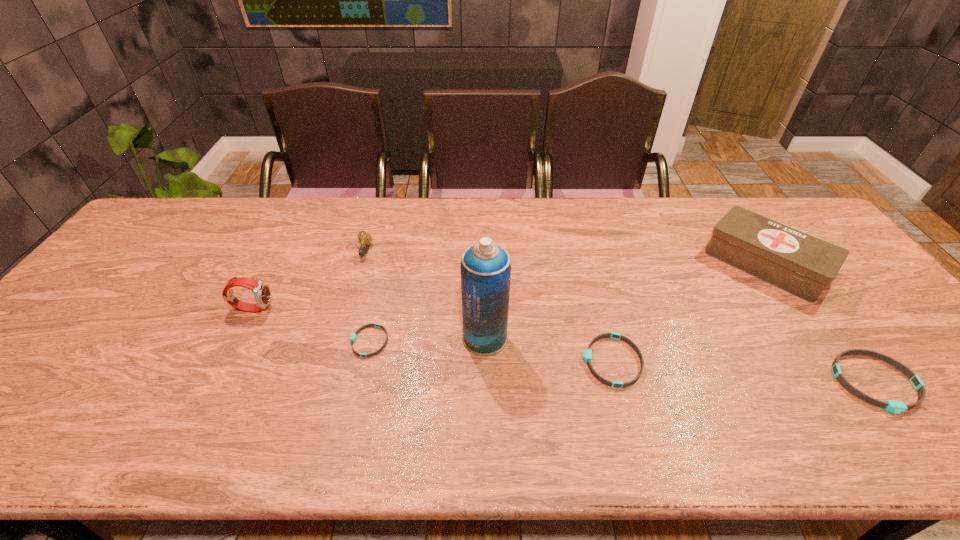
The image size is (960, 540). In order to click on free spot between the tallest object and the first-aid kit in this screenshot , I will do `click(625, 301)`.

Identify the location of object that is the sixth nearest to the fourth object from right to left. The image size is (960, 540). (897, 407).

Identify which object is the sixth nearest to the sixth object from right to left. Please provide its 2D coordinates. Your answer should be formatted as a tuple, i.e. [(x, y)], where the tuple contains the x and y coordinates of a point satisfying the conditions above.

[(897, 407)]

You are a GUI agent. You are given a task and a screenshot of the screen. Output one action in this format:
    pyautogui.click(x=<x>, y=<y>)
    Task: Click on the third closest wristband to the fourth shortest object
    
    Given the screenshot: What is the action you would take?
    pyautogui.click(x=897, y=407)

You are a GUI agent. You are given a task and a screenshot of the screen. Output one action in this format:
    pyautogui.click(x=<x>, y=<y>)
    Task: Click on the wristband that stands as the closest to the fifth object from left to right
    
    Given the screenshot: What is the action you would take?
    pyautogui.click(x=897, y=407)

The image size is (960, 540). In order to click on free region that satisfies the following two spatial constraints: 1. on the front-facing side of the fourth object from right to left; 2. on the right side of the sixth object from right to left in this screenshot , I will do tap(340, 338).

You are a GUI agent. You are given a task and a screenshot of the screen. Output one action in this format:
    pyautogui.click(x=<x>, y=<y>)
    Task: Click on the vacant area that satisfies the following two spatial constraints: 1. on the front-facing side of the escargot; 2. on the face of the leftmost object
    This screenshot has height=540, width=960.
    Given the screenshot: What is the action you would take?
    pyautogui.click(x=348, y=308)

I want to click on blank space that satisfies the following two spatial constraints: 1. on the face of the tallest object; 2. on the right side of the leftmost object, so click(238, 338).

What are the coordinates of `vacant region that satisfies the following two spatial constraints: 1. on the face of the tallest object; 2. on the left side of the leftmost object` in the screenshot? It's located at (238, 338).

The image size is (960, 540). I want to click on vacant space that satisfies the following two spatial constraints: 1. on the front-facing side of the first-aid kit; 2. on the left side of the escargot, so click(x=361, y=264).